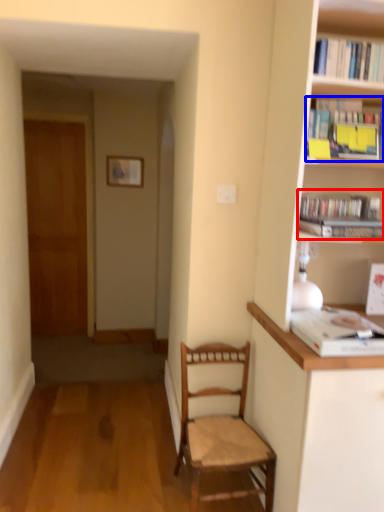
Question: Which object appears farthest to the camera in this image, book (highlighted by a red box) or book (highlighted by a blue box)?

Choices:
 (A) book
 (B) book

Answer: (A)